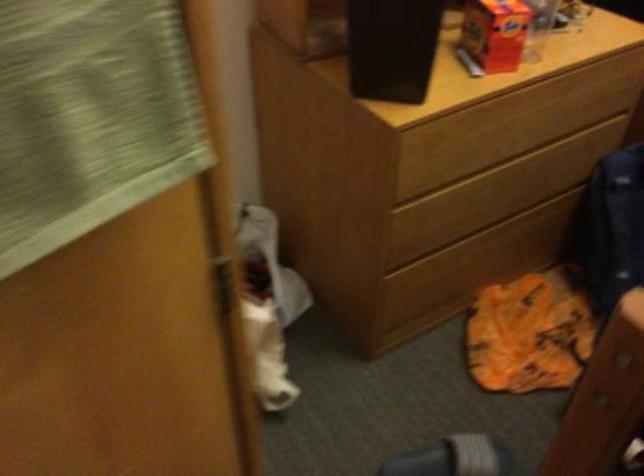
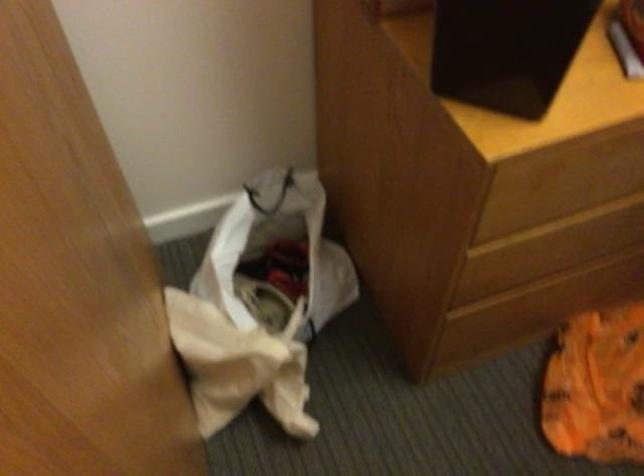
Where in the second image is the point corresponding to point 478,252 from the first image?

(583, 283)